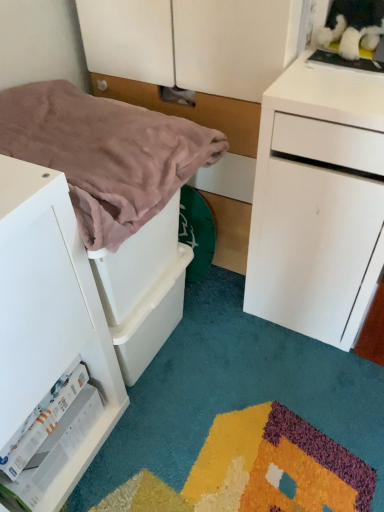
Looking at this image, measure the distance between matte white dresser at center and camera.

The distance of matte white dresser at center from camera is 92.89 centimeters.

In order to click on white matte drawer at left in this screenshot , I will do `click(49, 311)`.

From the image's perspective, is matte white dresser at center below white matte drawer at left?

No, from the image's perspective, matte white dresser at center is not below white matte drawer at left.

Which is less distant, (127, 96) or (6, 176)?

Point (127, 96) appears to be farther away from the viewer than point (6, 176).

Does matte white dresser at center contain white matte drawer at left?

No, white matte drawer at left is not inside matte white dresser at center.

Considering the relative sizes of matte white dresser at center and pink soft blanket at left in the image provided, is matte white dresser at center smaller than pink soft blanket at left?

No, matte white dresser at center is not smaller than pink soft blanket at left.

From the picture: Does matte white dresser at center have a lesser height compared to pink soft blanket at left?

In fact, matte white dresser at center may be taller than pink soft blanket at left.

Consider the image. Is matte white dresser at center inside the boundaries of pink soft blanket at left, or outside?

The correct answer is: outside.

Can you confirm if matte white dresser at center is positioned to the left of pink soft blanket at left?

In fact, matte white dresser at center is to the right of pink soft blanket at left.

Can we say pink soft blanket at left lies outside matte white dresser at center?

Yes, pink soft blanket at left is outside of matte white dresser at center.

From the image's perspective, which one is positioned lower, pink soft blanket at left or matte white dresser at center?

From the image's view, pink soft blanket at left is below.

Based on the photo, can you tell me how much pink soft blanket at left and matte white dresser at center differ in facing direction?

They differ by 90.1 degrees in their facing directions.

Who is shorter, pink soft blanket at left or matte white dresser at center?

pink soft blanket at left.

In the image, there is a matte white dresser at center. At what (x,y) coordinates should I click in order to perform the action: click on the chest of drawers below it (from the image's perspective). Please return your answer as a coordinate pair (x, y). This screenshot has width=384, height=512. Looking at the image, I should click on (49, 311).

In terms of width, does white matte drawer at left look wider or thinner when compared to matte white dresser at center?

Clearly, white matte drawer at left has less width compared to matte white dresser at center.

From a real-world perspective, is white matte drawer at left below matte white dresser at center?

Yes, from a real-world perspective, white matte drawer at left is beneath matte white dresser at center.

Considering the positions of objects white matte drawer at left and matte white dresser at center in the image provided, who is more to the right, white matte drawer at left or matte white dresser at center?

matte white dresser at center is more to the right.

Which is more to the left, white matte drawer at left or pink soft blanket at left?

white matte drawer at left.

From the image's perspective, which is below, white matte drawer at left or pink soft blanket at left?

From the image's view, white matte drawer at left is below.

Considering the points (53, 503) and (137, 184), which point is behind, point (53, 503) or point (137, 184)?

The point (53, 503) is behind.

Considering the positions of objects pink soft blanket at left and white matte drawer at left in the image provided, who is behind, pink soft blanket at left or white matte drawer at left?

pink soft blanket at left.

Do you think pink soft blanket at left is within white matte drawer at left, or outside of it?

pink soft blanket at left cannot be found inside white matte drawer at left.

Could you tell me if pink soft blanket at left is turned towards white matte drawer at left?

No, pink soft blanket at left is not aimed at white matte drawer at left.

Locate an element on the screen. dresser that appears above the white matte drawer at left (from a real-world perspective) is located at coordinates click(200, 78).

Find the location of a particular element. The image size is (384, 512). blanket below the matte white dresser at center (from the image's perspective) is located at coordinates (105, 154).

Looking at the image, which one is located further to white matte drawer at left, matte white dresser at center or pink soft blanket at left?

matte white dresser at center is positioned further to the anchor white matte drawer at left.

Estimate the real-world distances between objects in this image. Which object is further from white matte drawer at left, pink soft blanket at left or matte white dresser at center?

Among the two, matte white dresser at center is located further to white matte drawer at left.

Estimate the real-world distances between objects in this image. Which object is closer to matte white dresser at center, pink soft blanket at left or white matte drawer at left?

pink soft blanket at left lies closer to matte white dresser at center than the other object.

When comparing their distances from matte white dresser at center, does white matte drawer at left or pink soft blanket at left seem closer?

pink soft blanket at left is closer to matte white dresser at center.

Considering their positions, is matte white dresser at center positioned closer to pink soft blanket at left than white matte drawer at left?

white matte drawer at left.

Consider the image. Which object lies further to the anchor point pink soft blanket at left, white matte drawer at left or matte white dresser at center?

Among the two, matte white dresser at center is located further to pink soft blanket at left.

Find the location of a particular element. The height and width of the screenshot is (512, 384). blanket between matte white dresser at center and white matte drawer at left from top to bottom is located at coordinates (105, 154).